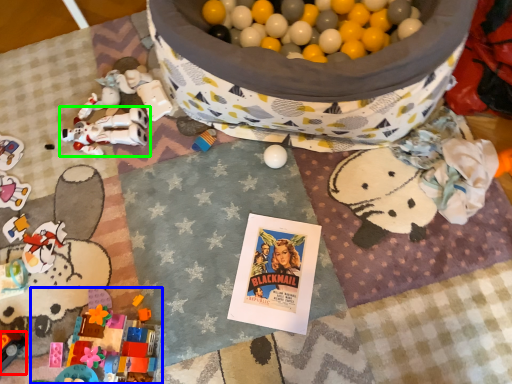
Question: Estimate the real-world distances between objects in this image. Which object is closer to toy (highlighted by a red box), toy (highlighted by a blue box) or toy (highlighted by a green box)?

Choices:
 (A) toy
 (B) toy

Answer: (A)